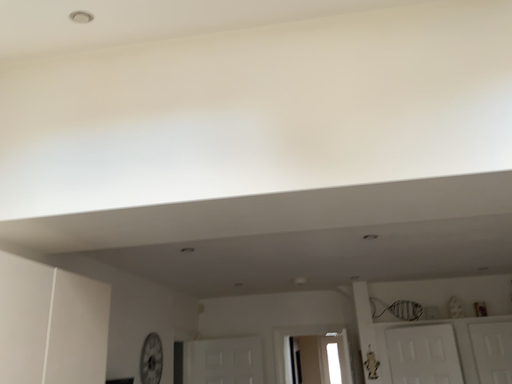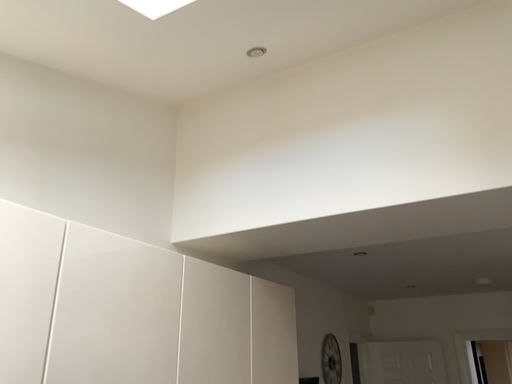
Question: How did the camera likely rotate when shooting the video?

Choices:
 (A) rotated right
 (B) rotated left

Answer: (B)